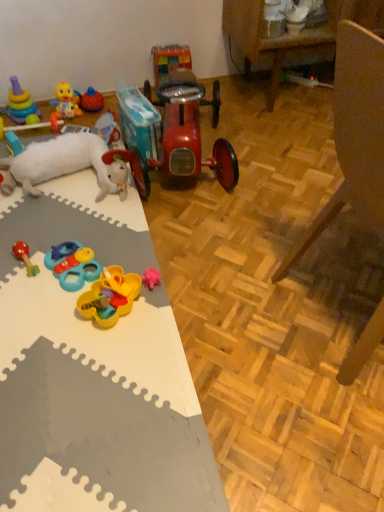
Where is `vacant area in front of shiny red car at center, which is the first toy in right-to-left order`? The width and height of the screenshot is (384, 512). vacant area in front of shiny red car at center, which is the first toy in right-to-left order is located at coordinates (192, 234).